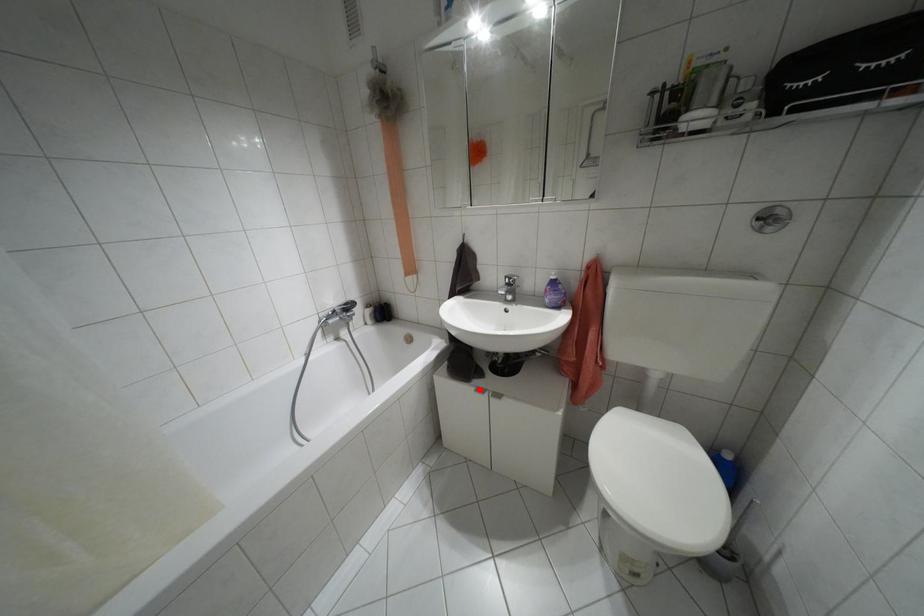
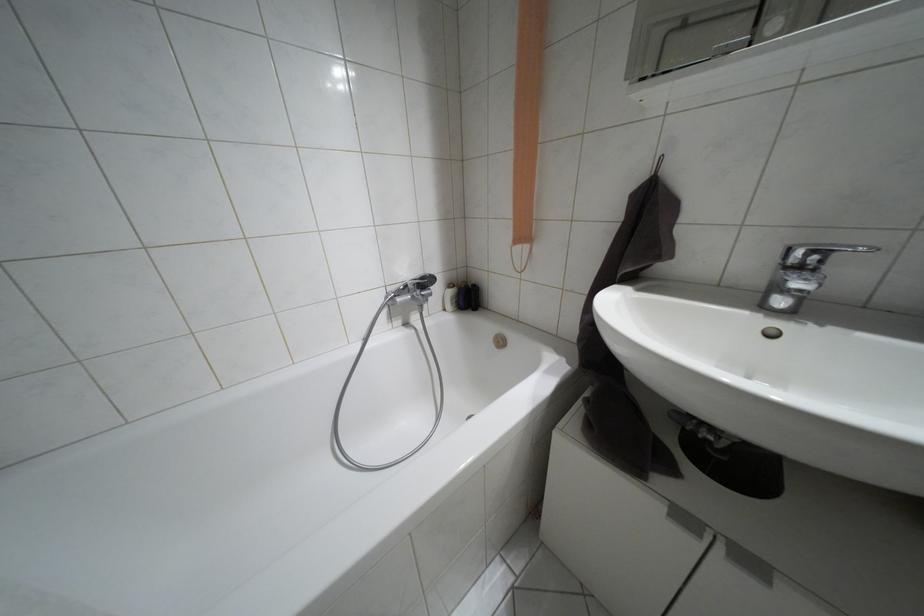
Question: I am providing you with two images of the same scene from different viewpoints. A red point is marked on the first image. Is the red point's position out of view in image 2?

Choices:
 (A) Yes
 (B) No

Answer: (B)